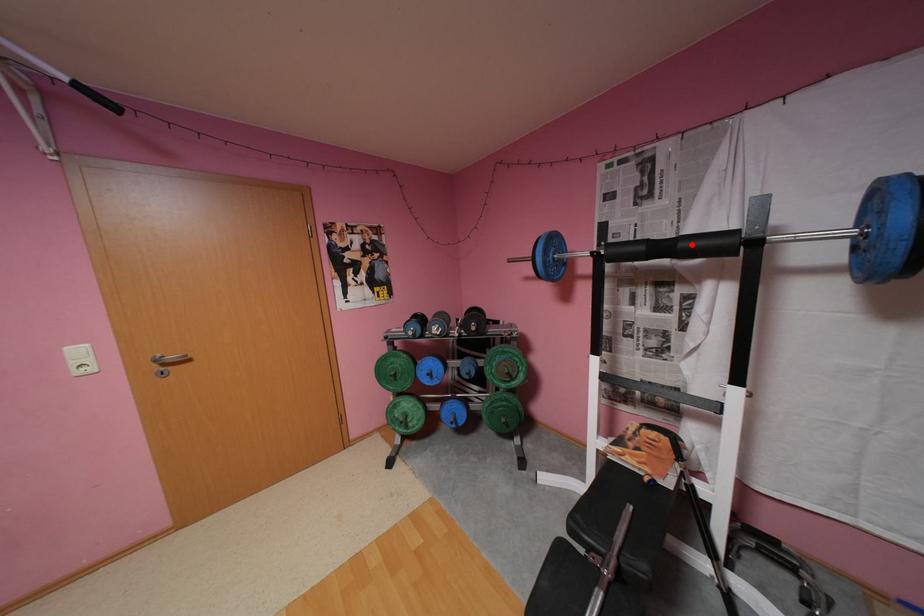
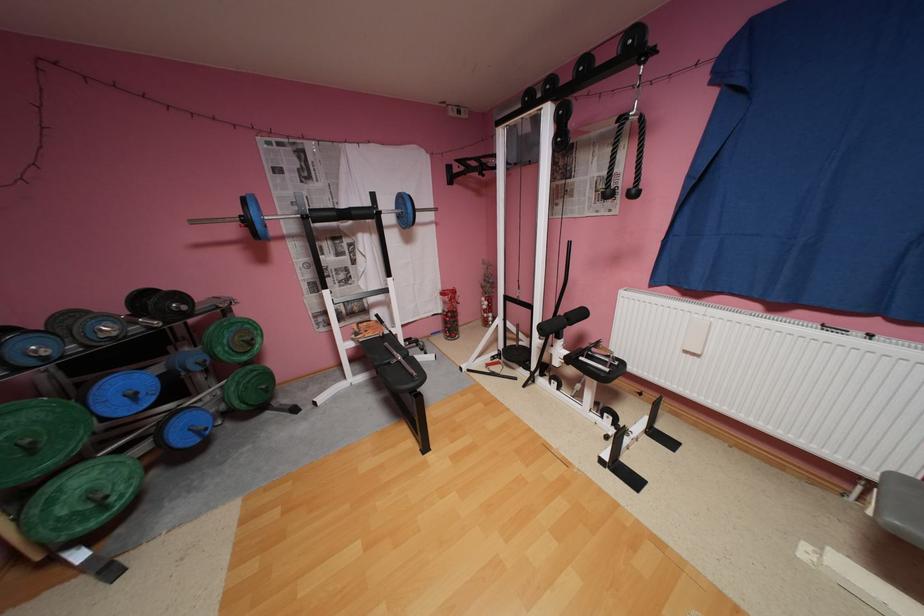
The point at the highlighted location is marked in the first image. Where is the corresponding point in the second image?

(362, 213)